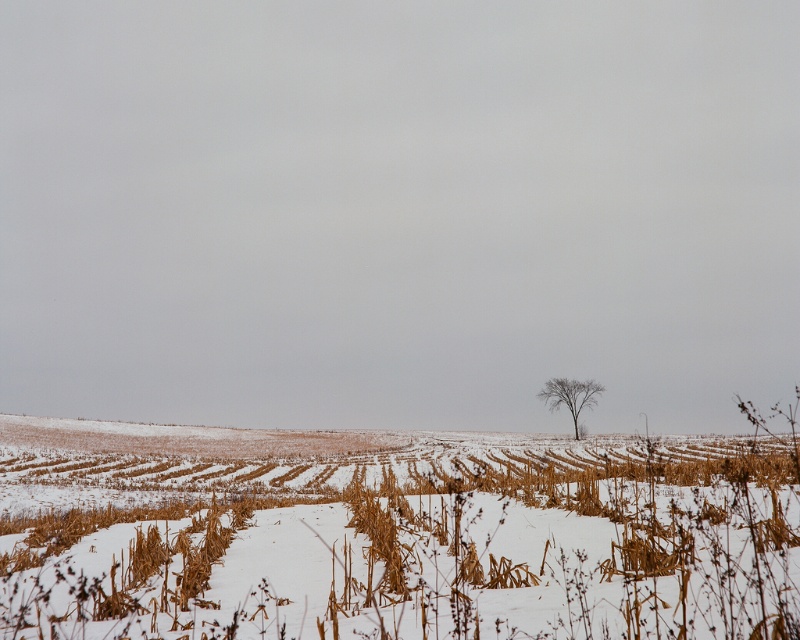
You are standing in the winter field and want to walk from the point closer to you to the point further away. Which path would you take between the two points, point (x=196, y=632) and point (x=572, y=413)?

You should walk from point (x=196, y=632) to point (x=572, y=413) because point (x=196, y=632) is closer to the viewer and the other point is further away.